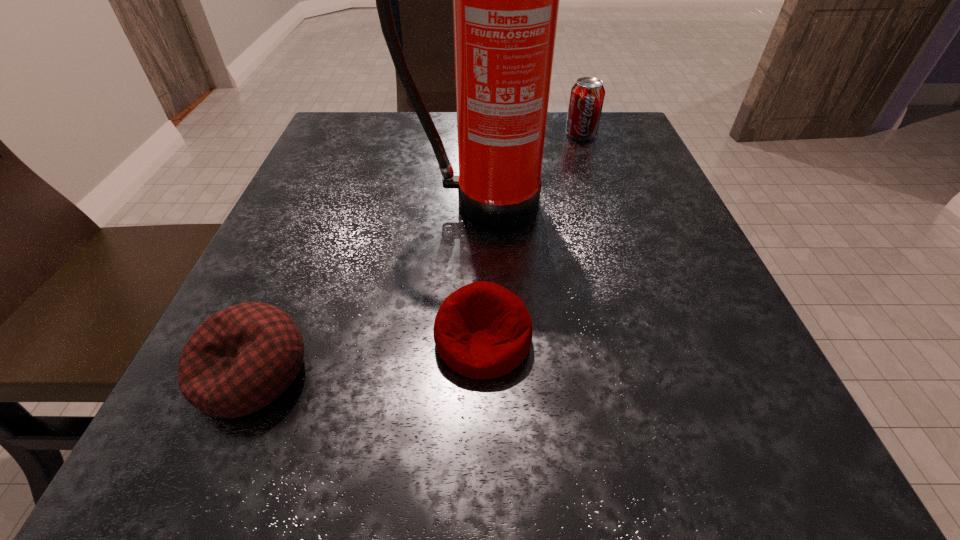
The width and height of the screenshot is (960, 540). I want to click on object present at the far edge, so click(x=587, y=95).

Where is `object present at the left edge`? This screenshot has height=540, width=960. object present at the left edge is located at coordinates (240, 359).

Find the location of `object present at the right edge`. object present at the right edge is located at coordinates (587, 95).

At what (x,y) coordinates should I click in order to perform the action: click on object located at the far right corner. Please return your answer as a coordinate pair (x, y). Image resolution: width=960 pixels, height=540 pixels. Looking at the image, I should click on (587, 95).

Find the location of a particular element. This screenshot has height=540, width=960. vacant region at the near edge of the desktop is located at coordinates (396, 464).

This screenshot has width=960, height=540. In order to click on free space at the left edge of the desktop in this screenshot , I will do `click(355, 213)`.

In the image, there is a desktop. Identify the location of free region at the right edge. (697, 370).

In the image, there is a desktop. Identify the location of free space at the far left corner. (325, 152).

The image size is (960, 540). In order to click on free space at the near left corner in this screenshot , I will do `click(250, 436)`.

Locate an element on the screen. free location at the far right corner is located at coordinates (605, 136).